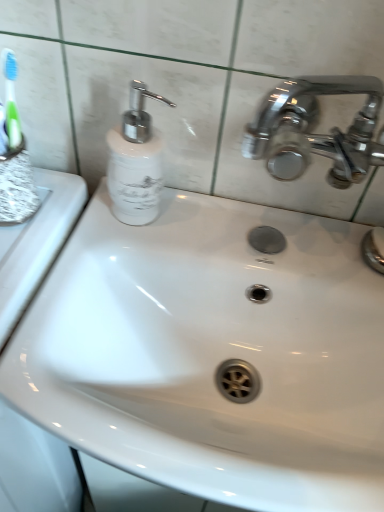
The height and width of the screenshot is (512, 384). Describe the element at coordinates (135, 161) in the screenshot. I see `white glossy soap dispenser at upper left` at that location.

Image resolution: width=384 pixels, height=512 pixels. What are the coordinates of `white glossy soap dispenser at upper left` in the screenshot? It's located at (135, 161).

What is the approximate height of polished chrome faucet at upper right?

0.55 inches.

I want to click on polished chrome faucet at upper right, so click(x=374, y=249).

The width and height of the screenshot is (384, 512). What do you see at coordinates (374, 249) in the screenshot? I see `polished chrome faucet at upper right` at bounding box center [374, 249].

In order to click on white glossy soap dispenser at upper left in this screenshot , I will do `click(135, 161)`.

Can you confirm if white glossy soap dispenser at upper left is positioned to the left of polished chrome faucet at upper right?

Yes.

Which object is closer to the camera taking this photo, white glossy soap dispenser at upper left or polished chrome faucet at upper right?

white glossy soap dispenser at upper left is in front.

Which point is more forward, (x=156, y=191) or (x=369, y=248)?

Positioned in front is point (x=369, y=248).

From the image's perspective, is white glossy soap dispenser at upper left above or below polished chrome faucet at upper right?

Based on their image positions, white glossy soap dispenser at upper left is located above polished chrome faucet at upper right.

From a real-world perspective, which is physically below, white glossy soap dispenser at upper left or polished chrome faucet at upper right?

polished chrome faucet at upper right, from a real-world perspective.

Looking at this image, considering the sizes of objects white glossy soap dispenser at upper left and polished chrome faucet at upper right in the image provided, who is thinner, white glossy soap dispenser at upper left or polished chrome faucet at upper right?

polished chrome faucet at upper right.

Considering the relative sizes of white glossy soap dispenser at upper left and polished chrome faucet at upper right in the image provided, is white glossy soap dispenser at upper left taller than polished chrome faucet at upper right?

Yes.

Can you confirm if white glossy soap dispenser at upper left is bigger than polished chrome faucet at upper right?

Indeed, white glossy soap dispenser at upper left has a larger size compared to polished chrome faucet at upper right.

Do you think white glossy soap dispenser at upper left is within polished chrome faucet at upper right, or outside of it?

The correct answer is: outside.

Are white glossy soap dispenser at upper left and polished chrome faucet at upper right located far from each other?

No, white glossy soap dispenser at upper left is in close proximity to polished chrome faucet at upper right.

Is white glossy soap dispenser at upper left aimed at polished chrome faucet at upper right?

No, white glossy soap dispenser at upper left is not facing towards polished chrome faucet at upper right.

I want to click on soap dispenser on the left of the polished chrome faucet at upper right, so click(x=135, y=161).

Which is more to the left, polished chrome faucet at upper right or white glossy soap dispenser at upper left?

white glossy soap dispenser at upper left is more to the left.

Is polished chrome faucet at upper right further to camera compared to white glossy soap dispenser at upper left?

Yes, polished chrome faucet at upper right is further from the viewer.

Between point (378, 262) and point (123, 159), which one is positioned in front?

The point (123, 159) is closer to the camera.

From the image's perspective, is polished chrome faucet at upper right located above or below white glossy soap dispenser at upper left?

From the image's perspective, polished chrome faucet at upper right appears below white glossy soap dispenser at upper left.

From a real-world perspective, is polished chrome faucet at upper right on white glossy soap dispenser at upper left?

No, from a real-world perspective, polished chrome faucet at upper right is not over white glossy soap dispenser at upper left

Which object is thinner, polished chrome faucet at upper right or white glossy soap dispenser at upper left?

Thinner between the two is polished chrome faucet at upper right.

Considering the relative sizes of polished chrome faucet at upper right and white glossy soap dispenser at upper left in the image provided, is polished chrome faucet at upper right taller than white glossy soap dispenser at upper left?

No, polished chrome faucet at upper right is not taller than white glossy soap dispenser at upper left.

Looking at the image, does polished chrome faucet at upper right seem bigger or smaller compared to white glossy soap dispenser at upper left?

polished chrome faucet at upper right is smaller than white glossy soap dispenser at upper left.

Looking at this image, is polished chrome faucet at upper right located outside white glossy soap dispenser at upper left?

Yes, polished chrome faucet at upper right is outside of white glossy soap dispenser at upper left.

Is polished chrome faucet at upper right in contact with white glossy soap dispenser at upper left?

No, polished chrome faucet at upper right is not beside white glossy soap dispenser at upper left.

Looking at this image, is polished chrome faucet at upper right aimed at white glossy soap dispenser at upper left?

No.

How many degrees apart are the facing directions of polished chrome faucet at upper right and white glossy soap dispenser at upper left?

There is a 0.584-degree angle between the facing directions of polished chrome faucet at upper right and white glossy soap dispenser at upper left.

This screenshot has height=512, width=384. Identify the location of plumbing fixture on the right of the white glossy soap dispenser at upper left. (374, 249).

Find the location of a particular element. Image resolution: width=384 pixels, height=512 pixels. soap dispenser on the left of polished chrome faucet at upper right is located at coordinates (135, 161).

I want to click on soap dispenser above the polished chrome faucet at upper right (from a real-world perspective), so click(135, 161).